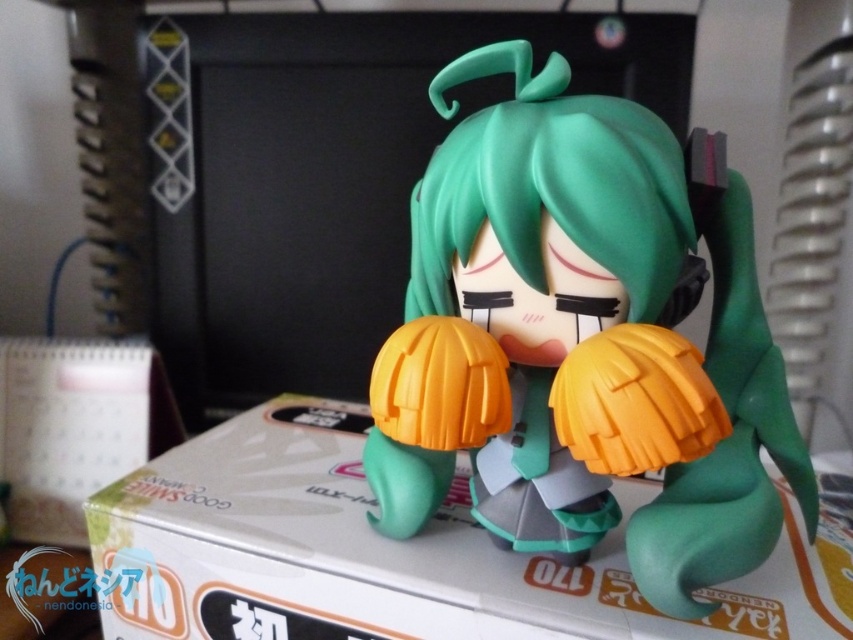
Question: Which point is farther to the camera?

Choices:
 (A) matte green figure at center
 (B) white matte box at center

Answer: (B)

Question: Which point is closer to the camera?

Choices:
 (A) matte green figure at center
 (B) white matte box at center
 (C) white glossy box at lower left

Answer: (A)

Question: From the image, what is the correct spatial relationship of matte green figure at center in relation to white matte box at center?

Choices:
 (A) left
 (B) right

Answer: (B)

Question: Among these points, which one is farthest from the camera?

Choices:
 (A) (448, 396)
 (B) (724, 612)
 (C) (84, 460)

Answer: (C)

Question: Can you confirm if matte green figure at center is positioned below white glossy box at lower left?

Choices:
 (A) yes
 (B) no

Answer: (B)

Question: Can you confirm if matte green figure at center is bigger than white glossy box at lower left?

Choices:
 (A) no
 (B) yes

Answer: (B)